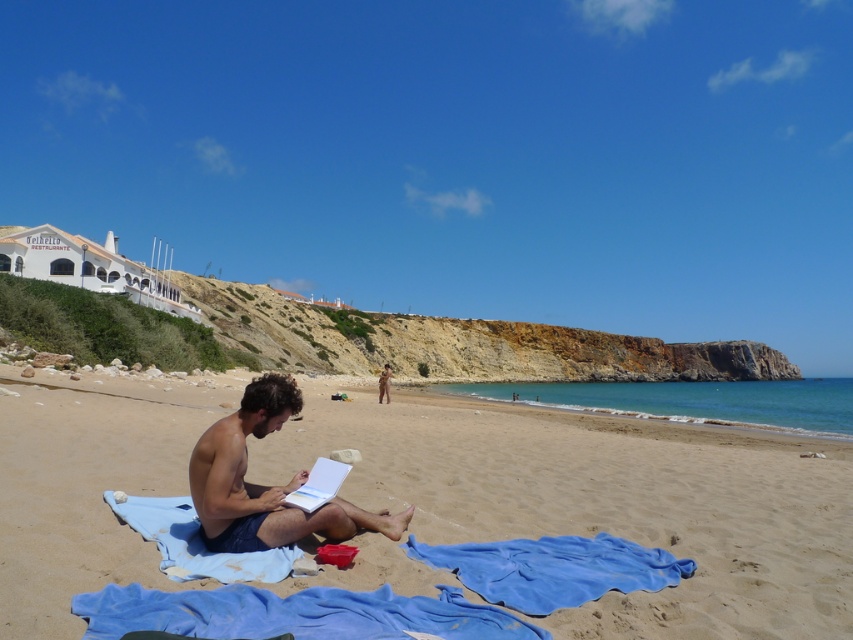
You are a photographer trying to capture the scene with the blue fabric towel at center and the nude human at center. Based on their positions, can you determine which object is closer to the camera?

The blue fabric towel at center is above the nude human at center, so the nude human at center is closer to the camera.

You are standing on the beach and see both the blue fabric at lower center and the blue soft towel at lower center. Which one is nearer to you?

The blue fabric at lower center is closer to the viewer than the blue soft towel at lower center.

You are a photographer trying to capture the blue fabric towel at center and the nude human at center in a single shot. Based on their sizes, which one will appear smaller in the photo?

The blue fabric towel at center is thinner than the nude human at center, so it will appear smaller in the photo.